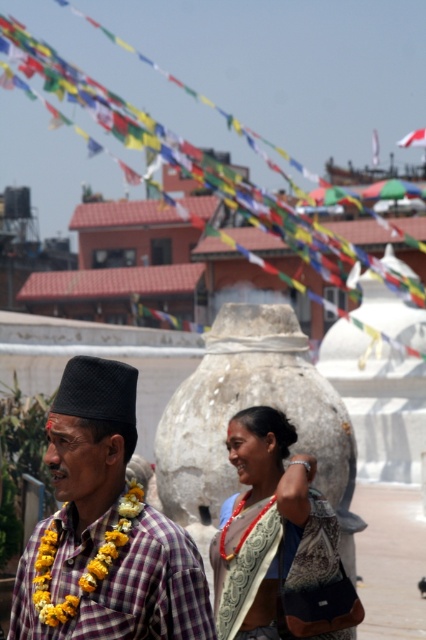
Can you confirm if plaid fabric shirt at center is wider than matte gold necklace at center?

Yes, plaid fabric shirt at center is wider than matte gold necklace at center.

In the scene shown: Is plaid fabric shirt at center thinner than matte gold necklace at center?

Incorrect, plaid fabric shirt at center's width is not less than matte gold necklace at center's.

Locate an element on the screen. plaid fabric shirt at center is located at coordinates (104, 529).

The image size is (426, 640). I want to click on plaid fabric shirt at center, so click(x=104, y=529).